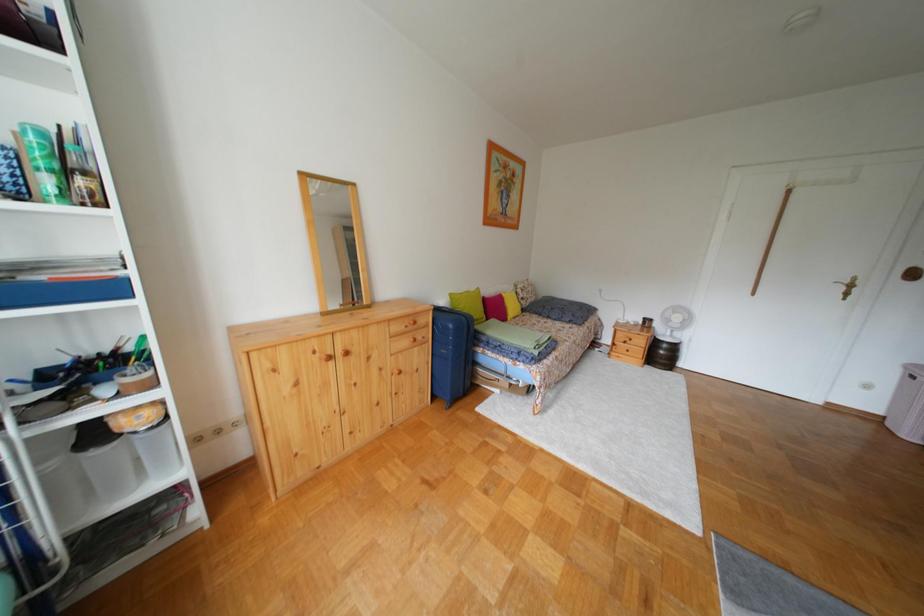
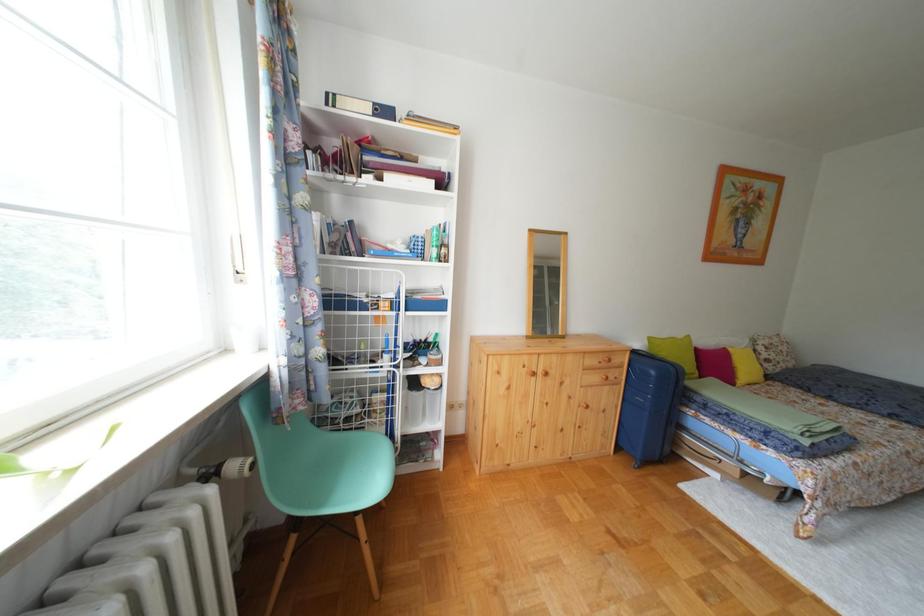
Question: The first image is from the beginning of the video and the second image is from the end. How did the camera likely rotate when shooting the video?

Choices:
 (A) Left
 (B) Right
 (C) Up
 (D) Down

Answer: (A)